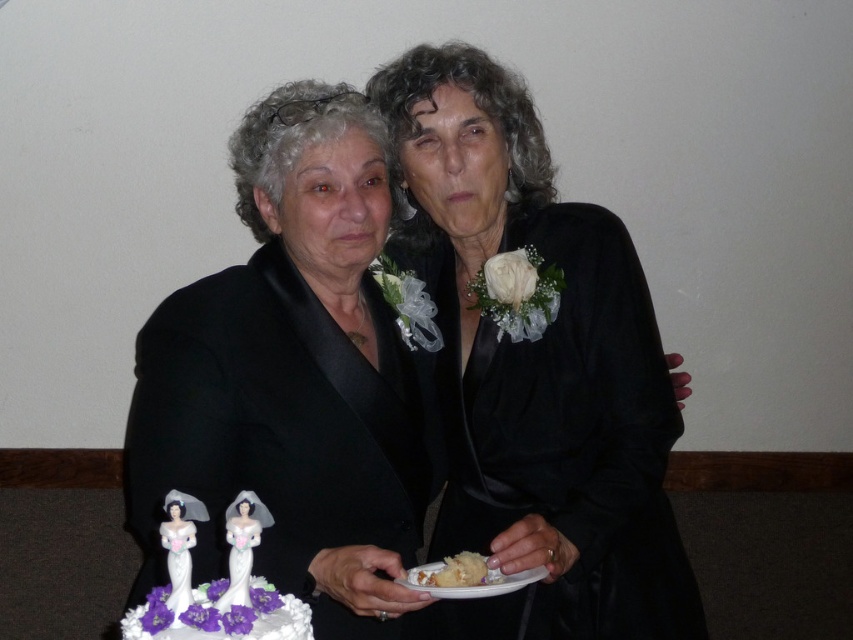
You are a photographer at a wedding reception. You need to adjust the lighting to highlight the black satin suit at center. Where should you position the light source relative to the camera to best illuminate this area?

The black satin suit at center is located at point (402, 390). To best illuminate this area, position the light source slightly to the right and above the camera, ensuring the light reaches the coordinates effectively without causing harsh shadows.

You are a photographer at a wedding reception and need to adjust the lighting to ensure both the black satin suit at center and the white fluffy cake at center are well lit. Given their sizes, which object should you focus on first to avoid shadows affecting the smaller one?

The white fluffy cake at center is smaller in width compared to the black satin suit at center, so you should focus on lighting the white fluffy cake at center first to prevent shadows from the larger suit from obscuring it.